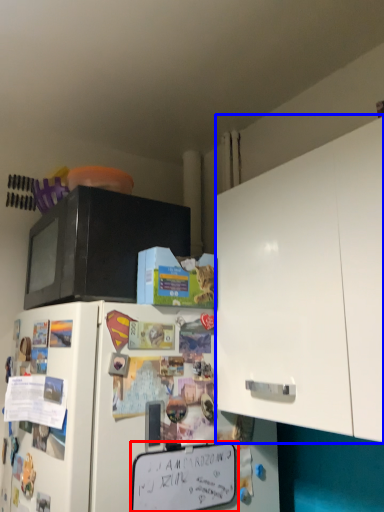
Question: Which object appears farthest to the camera in this image, bulletin board (highlighted by a red box) or cabinetry (highlighted by a blue box)?

Choices:
 (A) bulletin board
 (B) cabinetry

Answer: (A)